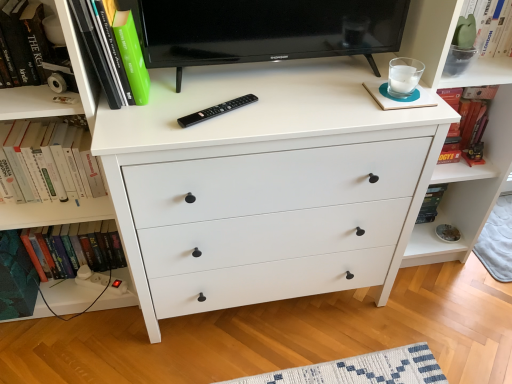
Where is `free space underneath black glossy tv at upper center (from a real-world perspective)`? Image resolution: width=512 pixels, height=384 pixels. free space underneath black glossy tv at upper center (from a real-world perspective) is located at coordinates (272, 76).